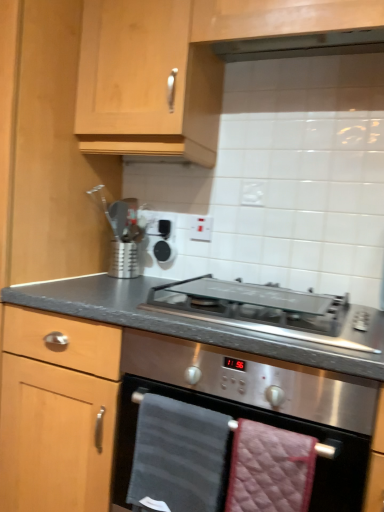
Question: Is satin silver utensil holder at upper center taller or shorter than dark gray textured towel at center, positioned as the 1th hand towel in left-to-right order?

Choices:
 (A) tall
 (B) short

Answer: (B)

Question: Is point (114, 249) positioned closer to the camera than point (198, 443)?

Choices:
 (A) closer
 (B) farther

Answer: (B)

Question: Considering the real-world distances, which object is farthest from the satin silver glass at center?

Choices:
 (A) quilted pink hand towel at lower center, the 2th hand towel from the left
 (B) satin silver utensil holder at upper center
 (C) dark gray textured towel at center, positioned as the 1th hand towel in left-to-right order
 (D) white plastic electric outlet at upper center
 (E) stainless steel oven at center

Answer: (B)

Question: Estimate the real-world distances between objects in this image. Which object is closer to the light wood cabinet at upper center?

Choices:
 (A) white plastic electric outlet at upper center
 (B) dark gray textured towel at center, acting as the second hand towel starting from the right
 (C) satin silver utensil holder at upper center
 (D) satin silver glass at center
 (E) stainless steel oven at center

Answer: (A)